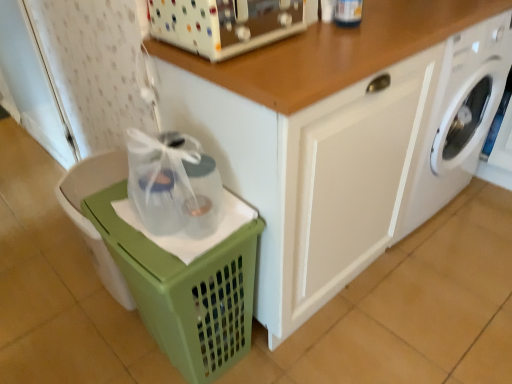
The width and height of the screenshot is (512, 384). What are the coordinates of `empty space that is ontop of green plastic basket at lower left (from a real-world perspective)` in the screenshot? It's located at pos(160,220).